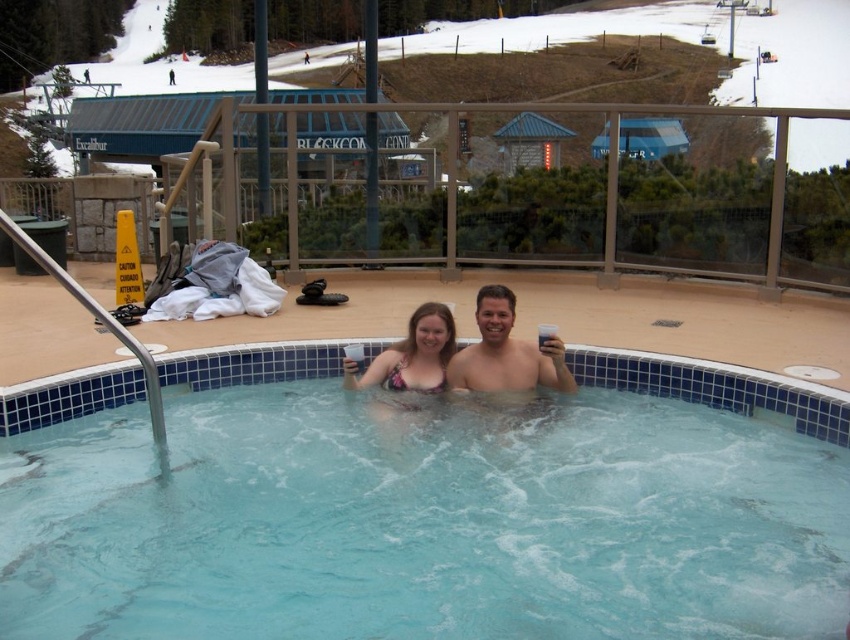
You are a photographer at the ski resort and want to capture a photo of the clear plastic cups at center and the smooth skin man at center. Since you want to focus on the cups, which object should you move closer to the camera to ensure the cups appear larger in the photo?

To make the clear plastic cups at center appear larger in the photo, you should move the clear plastic cups at center closer to the camera. Since the clear plastic cups at center are already bigger than the smooth skin man at center, moving them closer would enhance their size relative to the man.

You are a photographer taking a picture of the smooth skin man at center and the patterned bikini top at center. Which object is covering the other in the photo?

The smooth skin man at center is positioned over the patterned bikini top at center, so he is covering it in the photo.